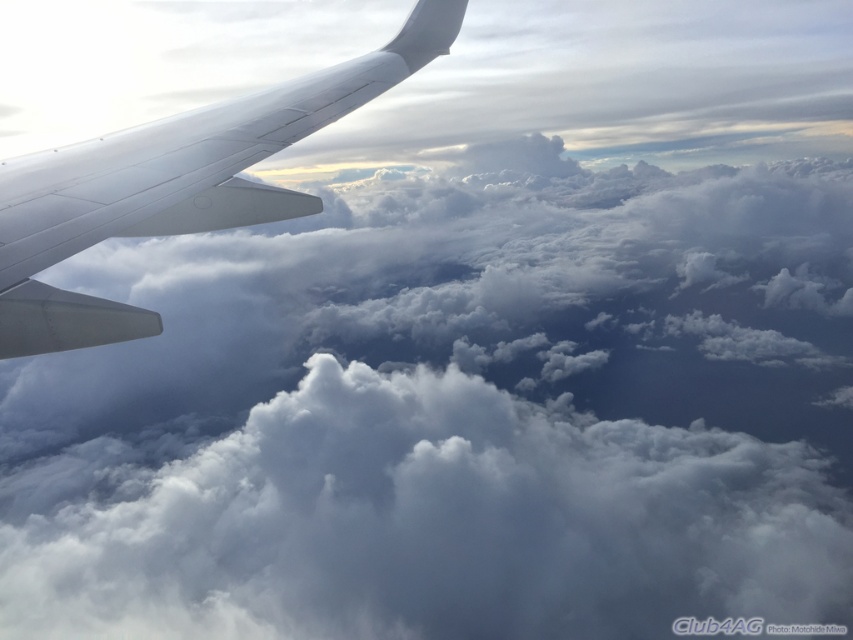
Does white fluffy cloud at center have a smaller size compared to white matte airplane wing at upper left?

Incorrect, white fluffy cloud at center is not smaller in size than white matte airplane wing at upper left.

Does white fluffy cloud at center have a greater height compared to white matte airplane wing at upper left?

Indeed, white fluffy cloud at center has a greater height compared to white matte airplane wing at upper left.

Between point (517, 616) and point (331, 115), which one is positioned behind?

Point (517, 616)

Where is `white fluffy cloud at center`? This screenshot has height=640, width=853. white fluffy cloud at center is located at coordinates (424, 522).